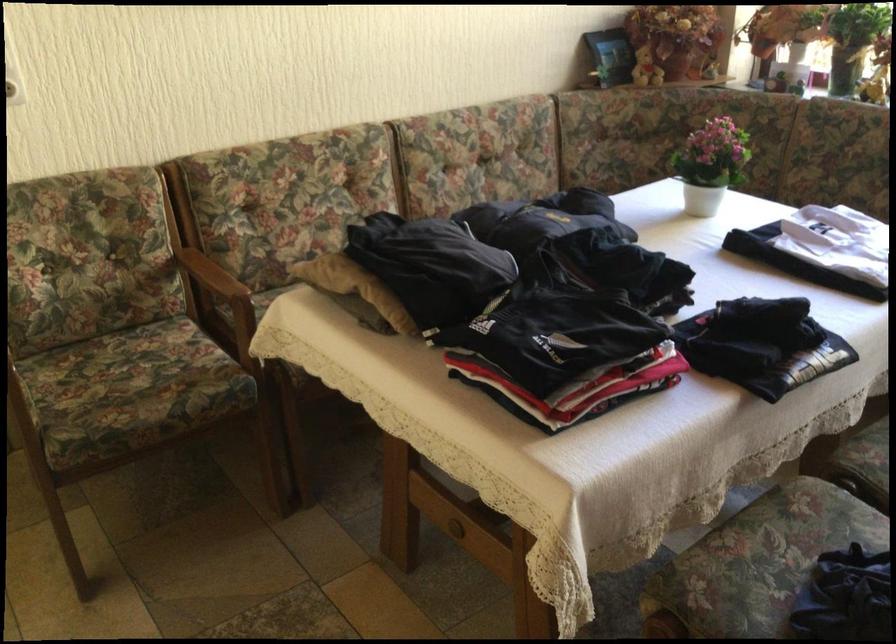
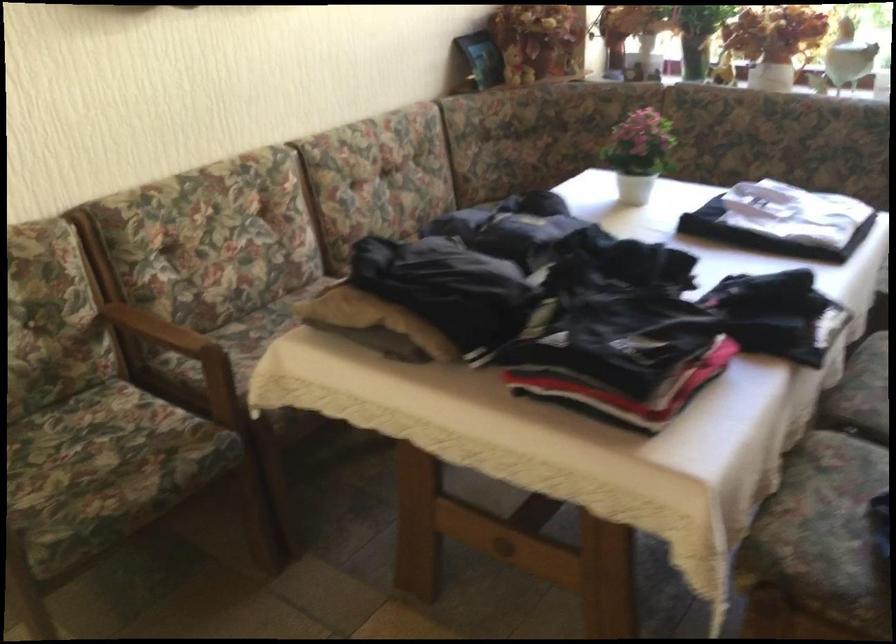
Where in the second image is the point corresponding to point (527, 312) from the first image?

(589, 317)